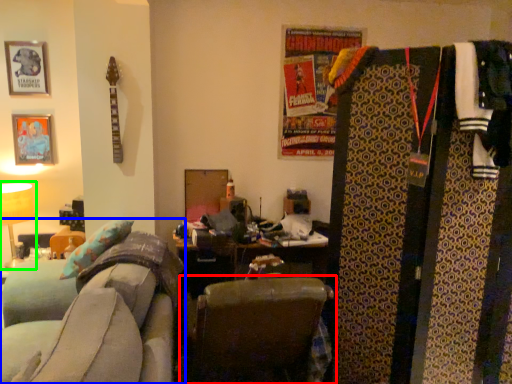
Question: Which is nearer to the chair (highlighted by a red box)? furniture (highlighted by a blue box) or table lamp (highlighted by a green box).

Choices:
 (A) furniture
 (B) table lamp

Answer: (A)